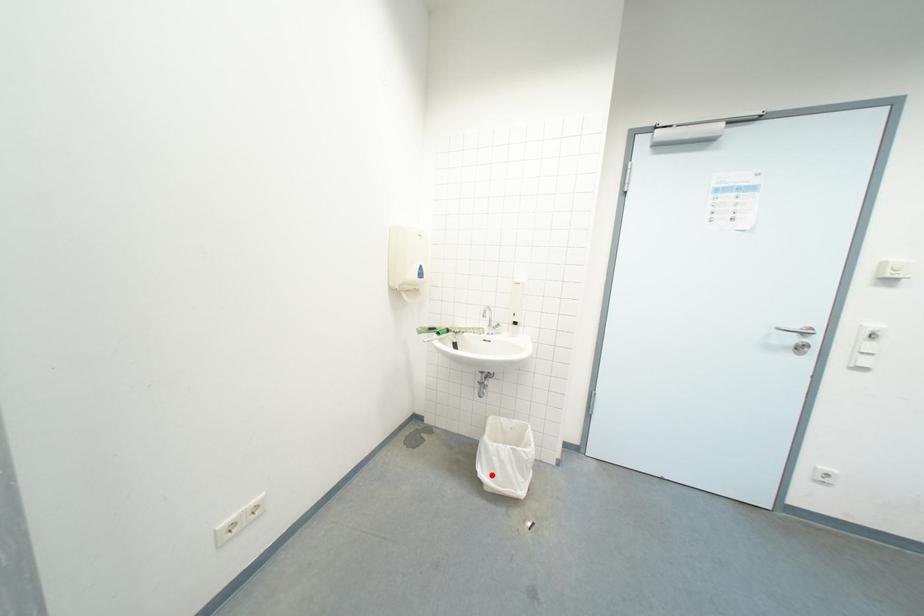
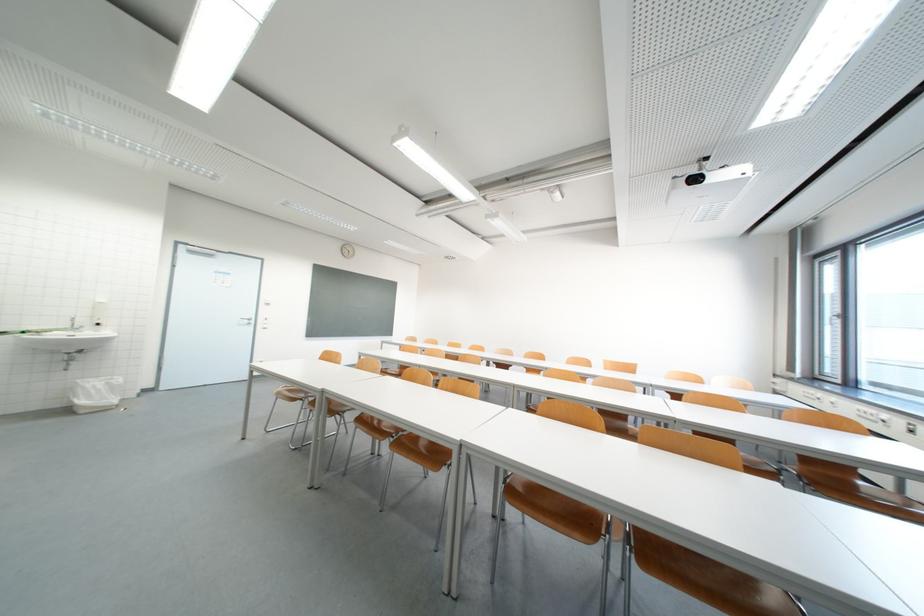
The point at the highlighted location is marked in the first image. Where is the corresponding point in the second image?

(91, 403)